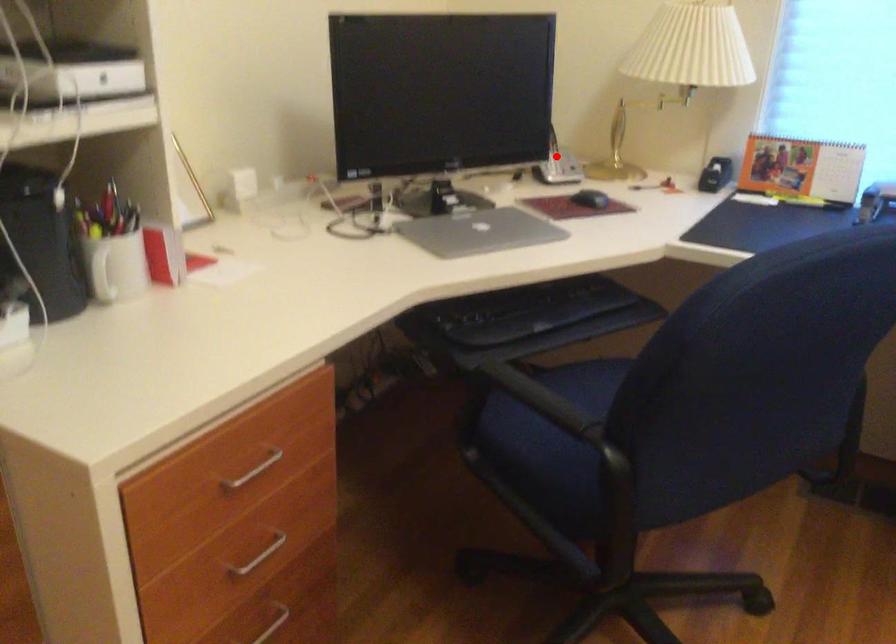
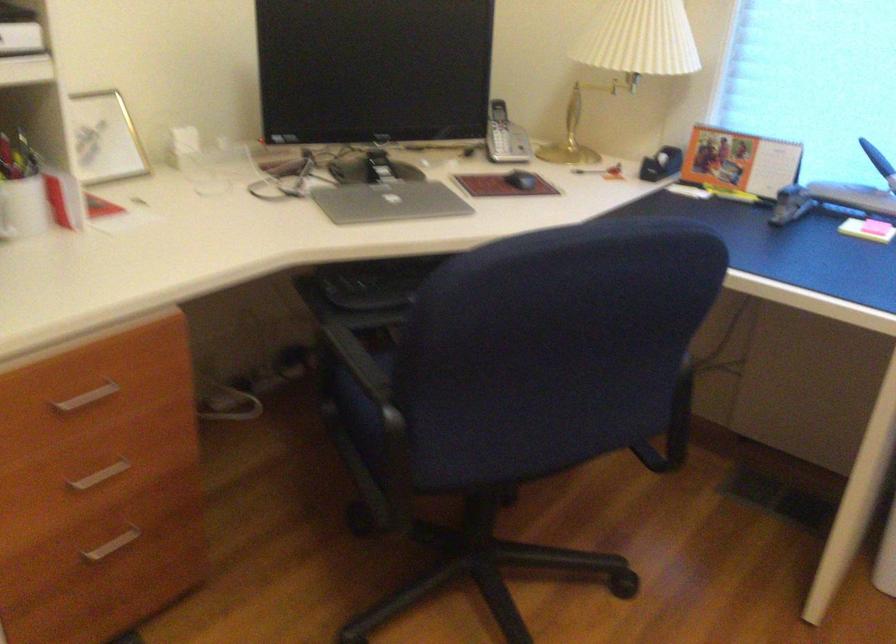
In the second image, find the point that corresponds to the highlighted location in the first image.

(504, 136)